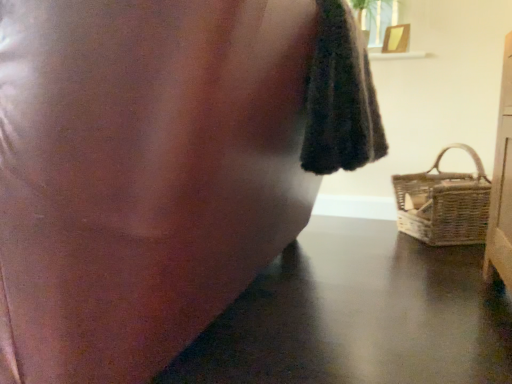
Measure the distance between point (485, 190) and camera.

Point (485, 190) is 6.35 feet from camera.

This screenshot has height=384, width=512. What are the coordinates of `rustic wicker picnic basket at right` in the screenshot? It's located at (444, 204).

Describe the element at coordinates (444, 204) in the screenshot. The width and height of the screenshot is (512, 384). I see `rustic wicker picnic basket at right` at that location.

You are a GUI agent. You are given a task and a screenshot of the screen. Output one action in this format:
    pyautogui.click(x=<x>, y=<y>)
    Task: Click on the rustic wicker picnic basket at right
    Image resolution: width=512 pixels, height=384 pixels.
    Given the screenshot: What is the action you would take?
    pyautogui.click(x=444, y=204)